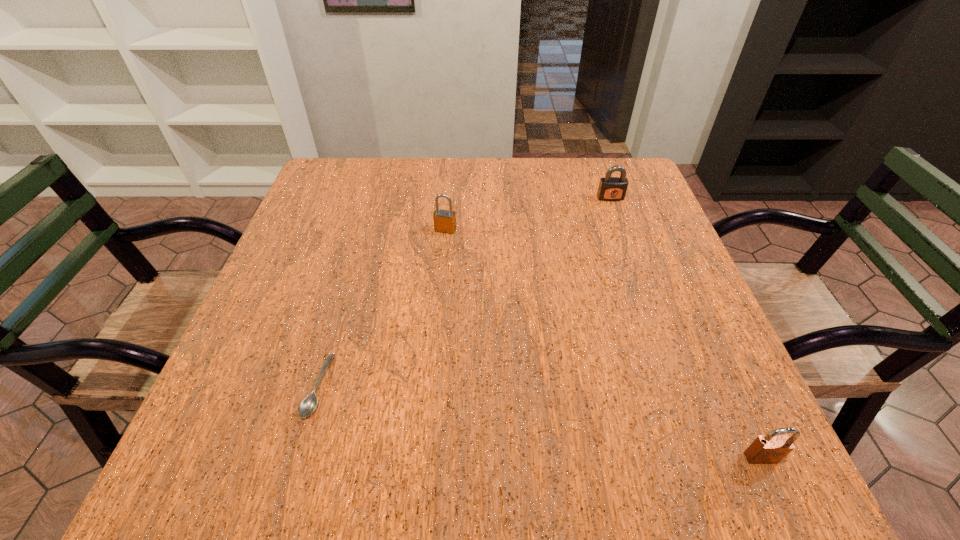
This screenshot has height=540, width=960. I want to click on vacant space located 0.380m on the back of the third farthest object, so 365,225.

This screenshot has width=960, height=540. What are the coordinates of `object situated at the far edge` in the screenshot? It's located at (610, 188).

This screenshot has width=960, height=540. Find the location of `object positioned at the near edge`. object positioned at the near edge is located at coordinates (772, 448).

You are a GUI agent. You are given a task and a screenshot of the screen. Output one action in this format:
    pyautogui.click(x=<x>, y=<y>)
    Task: Click on the object situated at the left edge
    Image resolution: width=960 pixels, height=540 pixels.
    Given the screenshot: What is the action you would take?
    pyautogui.click(x=308, y=405)

The width and height of the screenshot is (960, 540). I want to click on object located in the far right corner section of the desktop, so click(x=610, y=188).

This screenshot has height=540, width=960. Find the location of `object present at the near right corner`. object present at the near right corner is located at coordinates (772, 448).

Locate an element on the screen. Image resolution: width=960 pixels, height=540 pixels. vacant space at the far edge of the desktop is located at coordinates pyautogui.click(x=418, y=159).

In the image, there is a desktop. Find the location of `vacant space at the near edge`. vacant space at the near edge is located at coordinates (507, 466).

I want to click on vacant space at the left edge of the desktop, so [x=297, y=249].

Identify the location of vacant region at the right edge of the desktop. The height and width of the screenshot is (540, 960). (713, 352).